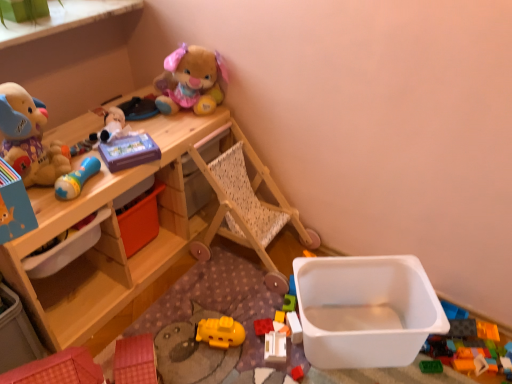
Question: Can we say white plastic container at lower right, which is the 2th storage box from left to right, lies outside blue rubber rattle at upper left, the fourth toy positioned from the top?

Choices:
 (A) yes
 (B) no

Answer: (A)

Question: Could you tell me if white plastic container at lower right, the first storage box positioned from the right, is facing blue rubber rattle at upper left, the sixth toy ordered from the bottom?

Choices:
 (A) yes
 (B) no

Answer: (B)

Question: Is white plastic container at lower right, which is the 2th storage box in top-to-bottom order, positioned with its back to blue rubber rattle at upper left, the fourth toy positioned from the top?

Choices:
 (A) no
 (B) yes

Answer: (A)

Question: Does white plastic container at lower right, which is the 2th storage box from left to right, come in front of blue rubber rattle at upper left, the fourth toy positioned from the top?

Choices:
 (A) yes
 (B) no

Answer: (B)

Question: Is white plastic container at lower right, the first storage box positioned from the right, far away from blue rubber rattle at upper left, the fourth toy positioned from the top?

Choices:
 (A) yes
 (B) no

Answer: (B)

Question: Considering the positions of point (30, 178) and point (92, 155), is point (30, 178) closer or farther from the camera than point (92, 155)?

Choices:
 (A) farther
 (B) closer

Answer: (B)

Question: Is soft plush toy at left, which appears as the second toy when viewed from the top, inside or outside of blue rubber rattle at upper left, the sixth toy ordered from the bottom?

Choices:
 (A) inside
 (B) outside

Answer: (B)

Question: Considering the positions of soft plush toy at left, placed as the eighth toy when sorted from bottom to top, and blue rubber rattle at upper left, the fourth toy positioned from the top, in the image, is soft plush toy at left, placed as the eighth toy when sorted from bottom to top, bigger or smaller than blue rubber rattle at upper left, the fourth toy positioned from the top,?

Choices:
 (A) big
 (B) small

Answer: (A)

Question: Is soft plush toy at left, placed as the eighth toy when sorted from bottom to top, taller or shorter than blue rubber rattle at upper left, the sixth toy ordered from the bottom?

Choices:
 (A) tall
 (B) short

Answer: (A)

Question: From their relative heights in the image, would you say yellow plastic submarine at center, the sixth toy when ordered from top to bottom, is taller or shorter than yellow plastic toy at center, the 5th toy when ordered from top to bottom?

Choices:
 (A) short
 (B) tall

Answer: (B)

Question: Is yellow plastic submarine at center, which ranks as the fourth toy in bottom-to-top order, to the left or to the right of yellow plastic toy at center, the 5th toy positioned from the bottom, in the image?

Choices:
 (A) right
 (B) left

Answer: (B)

Question: Considering the positions of point 217,329 and point 274,316, is point 217,329 closer or farther from the camera than point 274,316?

Choices:
 (A) closer
 (B) farther

Answer: (A)

Question: From the image's perspective, is yellow plastic submarine at center, which ranks as the fourth toy in bottom-to-top order, above or below yellow plastic toy at center, the 5th toy when ordered from top to bottom?

Choices:
 (A) above
 (B) below

Answer: (B)

Question: Looking at their shapes, would you say purple matte tissue box at upper center, marked as the seventh toy in a bottom-to-top arrangement, is wider or thinner than fluffy plush rabbit at upper center, which ranks as the 9th toy in bottom-to-top order?

Choices:
 (A) thin
 (B) wide

Answer: (A)

Question: In terms of height, does purple matte tissue box at upper center, marked as the seventh toy in a bottom-to-top arrangement, look taller or shorter compared to fluffy plush rabbit at upper center, which ranks as the 9th toy in bottom-to-top order?

Choices:
 (A) short
 (B) tall

Answer: (A)